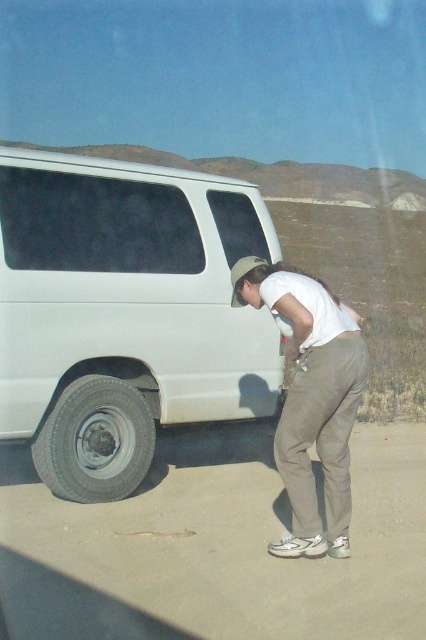
You are a delivery driver who needs to load packages into the white matte van at left. You are currently standing near the white cotton shirt at center. To reach the van, should you walk to your left or right?

The white matte van at left is positioned on the left side of white cotton shirt at center. Since you are standing near the white cotton shirt at center, you should walk to your left to reach the van.

You are a delivery driver who needs to load a package onto the white matte van at left. The gray rubber tire at lower left is blocking the loading area. Can you move the tire to the side?

The white matte van at left is located above the gray rubber tire at lower left, so the tire is positioned below the van. Since the tire is already beneath the van, it cannot be moved to the side without first moving the van itself.